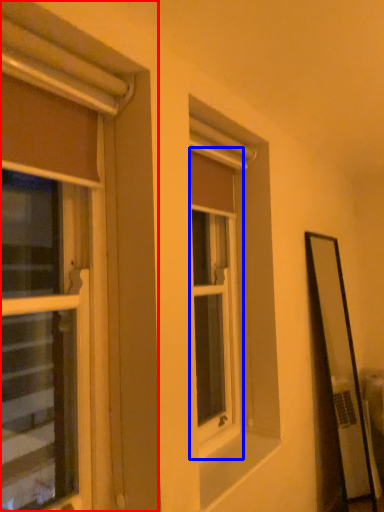
Question: Which object is closer to the camera taking this photo, window (highlighted by a red box) or window (highlighted by a blue box)?

Choices:
 (A) window
 (B) window

Answer: (A)